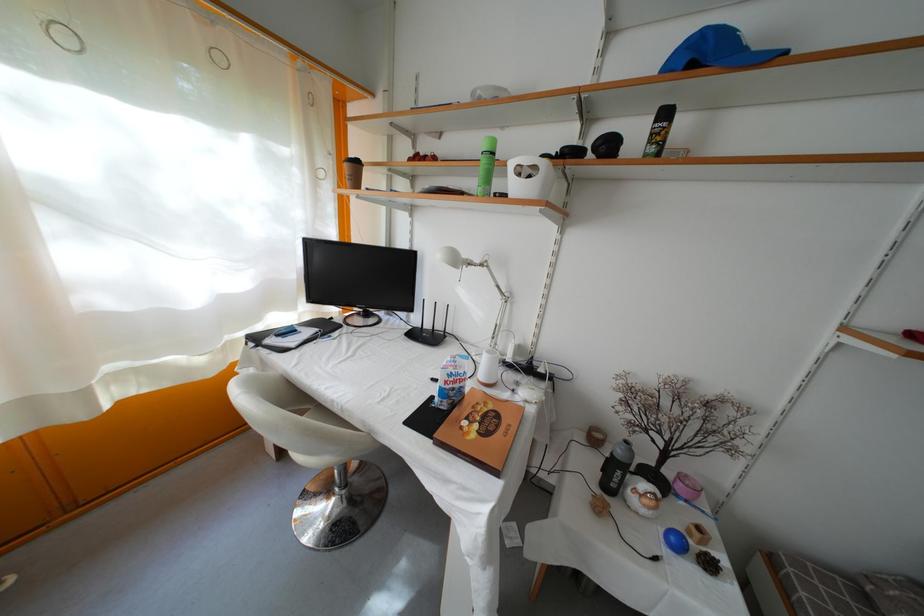
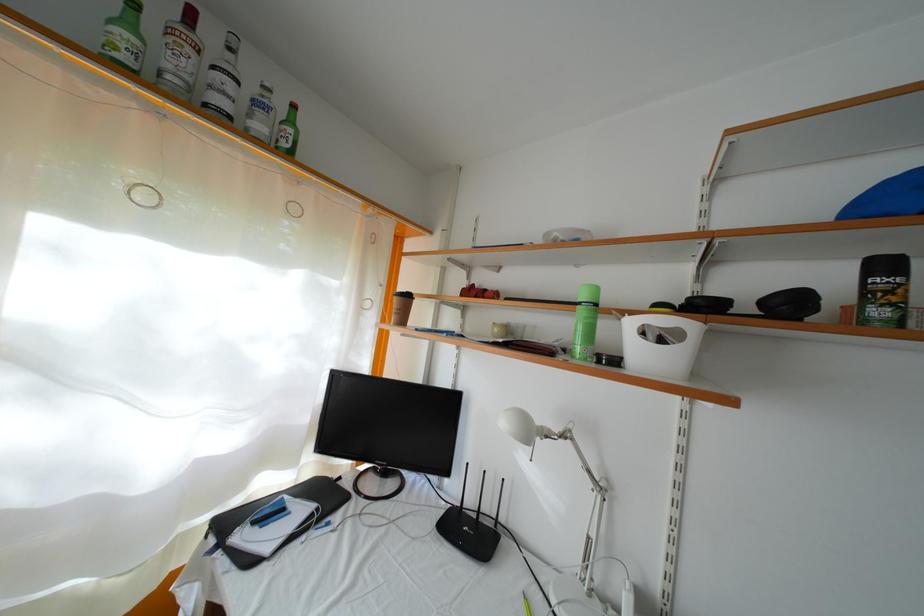
The point at (351, 171) is marked in the first image. Where is the corresponding point in the second image?

(400, 305)